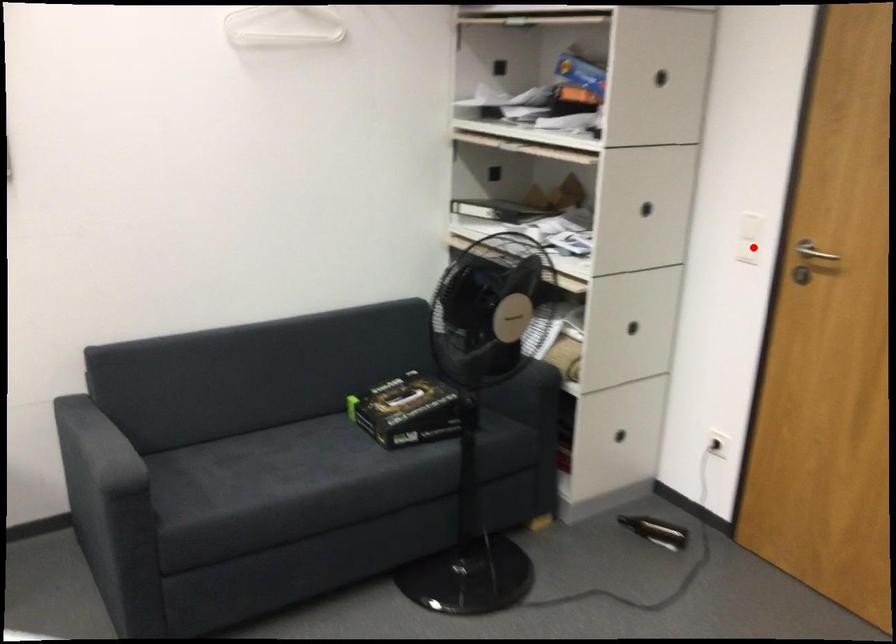
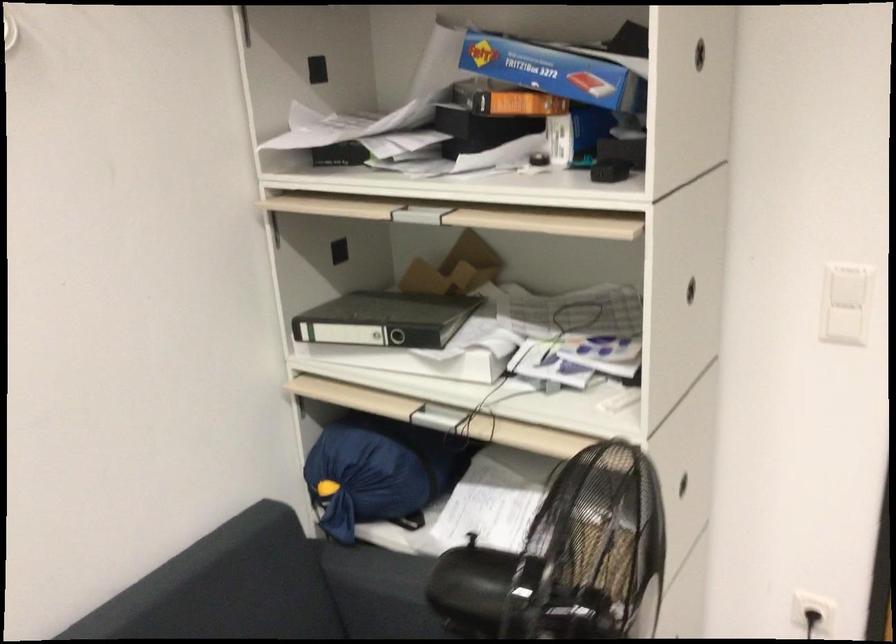
Question: I am providing you with two images of the same scene from different viewpoints. In image1, a red point is highlighted. Considering the same 3D point in image2, which of the following is correct?

Choices:
 (A) It is closer
 (B) It is farther

Answer: (A)